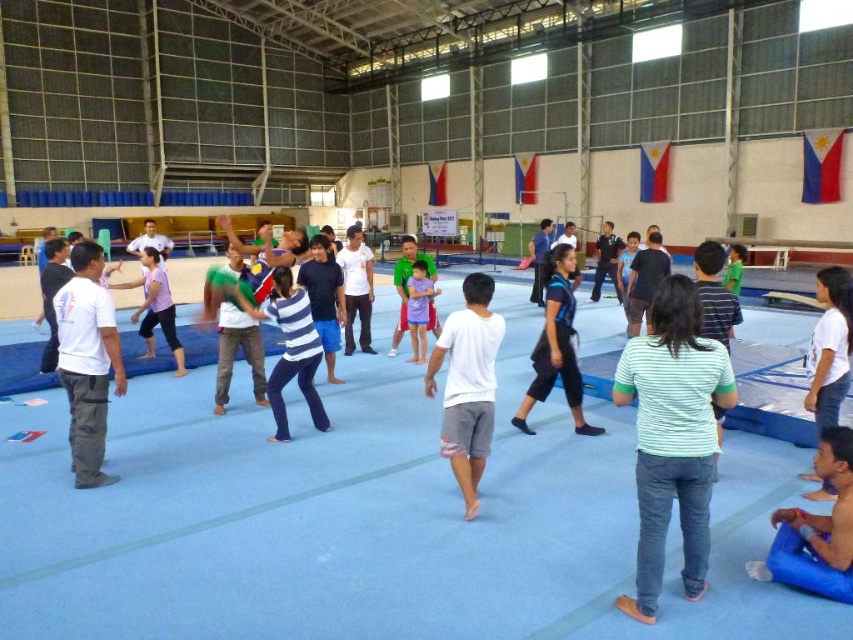
Question: Is green striped shirt at center thinner than purple fabric dress at center?

Choices:
 (A) no
 (B) yes

Answer: (A)

Question: Among these points, which one is farthest from the camera?

Choices:
 (A) (566, 294)
 (B) (105, 332)
 (C) (473, 380)

Answer: (A)

Question: Which point is closer to the camera?

Choices:
 (A) blue matte shorts at center
 (B) white matte pants at left

Answer: (B)

Question: Does green striped shirt at center appear on the right side of white cotton shirt at center?

Choices:
 (A) no
 (B) yes

Answer: (B)

Question: Does green striped shirt at center have a smaller size compared to blue matte shorts at center?

Choices:
 (A) no
 (B) yes

Answer: (B)

Question: Estimate the real-world distances between objects in this image. Which object is closer to the green striped shirt at center?

Choices:
 (A) white cotton shirt at center
 (B) blue matte shorts at center
 (C) white matte pants at left

Answer: (A)